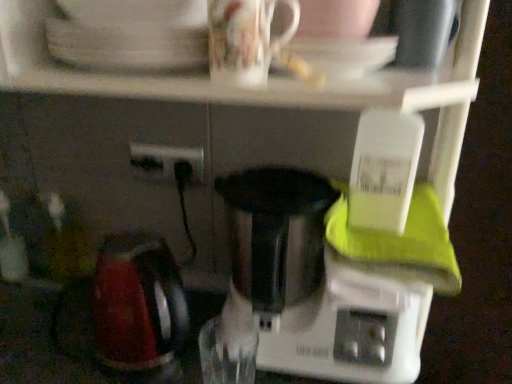
Question: Considering the relative positions of black plastic power plugs and sockets at center and white glossy saucer at upper center in the image provided, is black plastic power plugs and sockets at center behind white glossy saucer at upper center?

Choices:
 (A) no
 (B) yes

Answer: (B)

Question: Is black plastic power plugs and sockets at center completely or partially outside of white glossy saucer at upper center?

Choices:
 (A) no
 (B) yes

Answer: (B)

Question: Considering the relative sizes of black plastic power plugs and sockets at center and white glossy saucer at upper center in the image provided, is black plastic power plugs and sockets at center bigger than white glossy saucer at upper center?

Choices:
 (A) no
 (B) yes

Answer: (A)

Question: Considering the relative positions of black plastic power plugs and sockets at center and white glossy saucer at upper center in the image provided, is black plastic power plugs and sockets at center to the left of white glossy saucer at upper center from the viewer's perspective?

Choices:
 (A) yes
 (B) no

Answer: (A)

Question: From the image's perspective, is black plastic power plugs and sockets at center over white glossy saucer at upper center?

Choices:
 (A) yes
 (B) no

Answer: (B)

Question: Considering the positions of point (251, 46) and point (370, 64), is point (251, 46) closer or farther from the camera than point (370, 64)?

Choices:
 (A) farther
 (B) closer

Answer: (B)

Question: Considering the positions of glossy ceramic mug at upper center and white glossy saucer at upper center in the image, is glossy ceramic mug at upper center wider or thinner than white glossy saucer at upper center?

Choices:
 (A) wide
 (B) thin

Answer: (B)

Question: Considering their positions, is glossy ceramic mug at upper center located in front of or behind white glossy saucer at upper center?

Choices:
 (A) front
 (B) behind

Answer: (A)

Question: Considering the positions of glossy ceramic mug at upper center and white glossy saucer at upper center in the image, is glossy ceramic mug at upper center taller or shorter than white glossy saucer at upper center?

Choices:
 (A) tall
 (B) short

Answer: (A)

Question: Is glossy ceramic mug at upper center taller or shorter than white plastic mixer at center?

Choices:
 (A) short
 (B) tall

Answer: (A)

Question: Considering the relative positions of glossy ceramic mug at upper center and white plastic mixer at center in the image provided, is glossy ceramic mug at upper center to the left or to the right of white plastic mixer at center?

Choices:
 (A) right
 (B) left

Answer: (B)

Question: From a real-world perspective, is glossy ceramic mug at upper center physically located above or below white plastic mixer at center?

Choices:
 (A) below
 (B) above

Answer: (B)

Question: From the image's perspective, is glossy ceramic mug at upper center positioned above or below white plastic mixer at center?

Choices:
 (A) above
 (B) below

Answer: (A)

Question: From the image's perspective, is black plastic power plugs and sockets at center positioned above or below white glossy saucer at upper center?

Choices:
 (A) above
 (B) below

Answer: (B)

Question: In the image, is black plastic power plugs and sockets at center positioned in front of or behind white glossy saucer at upper center?

Choices:
 (A) behind
 (B) front

Answer: (A)